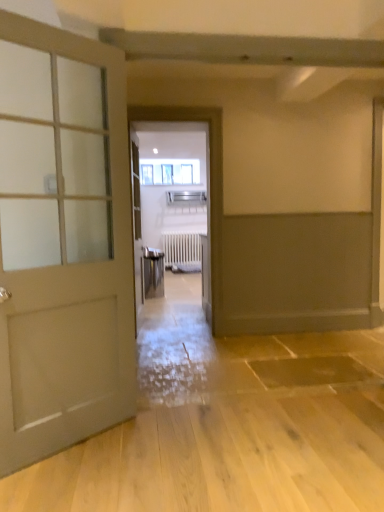
Question: Can you confirm if matte white door at left is shorter than clear glass window at center?

Choices:
 (A) no
 (B) yes

Answer: (A)

Question: From the image's perspective, is matte white door at left above clear glass window at center?

Choices:
 (A) yes
 (B) no

Answer: (B)

Question: Does matte white door at left have a greater width compared to clear glass window at center?

Choices:
 (A) yes
 (B) no

Answer: (A)

Question: Is matte white door at left to the right of clear glass window at center from the viewer's perspective?

Choices:
 (A) yes
 (B) no

Answer: (B)

Question: Is matte white door at left further to camera compared to clear glass window at center?

Choices:
 (A) yes
 (B) no

Answer: (B)

Question: Is matte white door at left aimed at clear glass window at center?

Choices:
 (A) no
 (B) yes

Answer: (A)

Question: Is clear glass window at center not within metallic elevator at center?

Choices:
 (A) yes
 (B) no

Answer: (A)

Question: From a real-world perspective, is clear glass window at center beneath metallic elevator at center?

Choices:
 (A) no
 (B) yes

Answer: (A)

Question: Is clear glass window at center far from metallic elevator at center?

Choices:
 (A) no
 (B) yes

Answer: (B)

Question: Is clear glass window at center oriented towards metallic elevator at center?

Choices:
 (A) yes
 (B) no

Answer: (A)

Question: Considering the relative sizes of clear glass window at center and metallic elevator at center in the image provided, is clear glass window at center thinner than metallic elevator at center?

Choices:
 (A) yes
 (B) no

Answer: (A)

Question: Considering the relative sizes of clear glass window at center and metallic elevator at center in the image provided, is clear glass window at center smaller than metallic elevator at center?

Choices:
 (A) no
 (B) yes

Answer: (B)

Question: Would you consider clear glass window at center to be distant from white matte radiator at center?

Choices:
 (A) yes
 (B) no

Answer: (A)